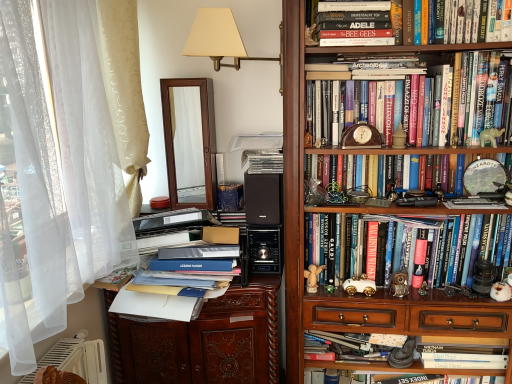
Question: Can you confirm if wooden bookshelf at upper right is bigger than beige fabric lampshade at upper center?

Choices:
 (A) no
 (B) yes

Answer: (B)

Question: Can you confirm if wooden bookshelf at upper right is positioned to the left of beige fabric lampshade at upper center?

Choices:
 (A) no
 (B) yes

Answer: (A)

Question: Can you confirm if wooden bookshelf at upper right is shorter than beige fabric lampshade at upper center?

Choices:
 (A) no
 (B) yes

Answer: (A)

Question: Is wooden bookshelf at upper right in front of beige fabric lampshade at upper center?

Choices:
 (A) no
 (B) yes

Answer: (B)

Question: From a real-world perspective, is wooden bookshelf at upper right positioned over beige fabric lampshade at upper center based on gravity?

Choices:
 (A) no
 (B) yes

Answer: (A)

Question: From a real-world perspective, is black matte speaker at center positioned above or below hardcover book at upper center, which is the fifth book in bottom-to-top order?

Choices:
 (A) above
 (B) below

Answer: (B)

Question: Considering the positions of black matte speaker at center and hardcover book at upper center, which is the fifth book in bottom-to-top order, in the image, is black matte speaker at center wider or thinner than hardcover book at upper center, which is the fifth book in bottom-to-top order,?

Choices:
 (A) thin
 (B) wide

Answer: (A)

Question: From the image's perspective, relative to hardcover book at upper center, the 2th book positioned from the top, is black matte speaker at center above or below?

Choices:
 (A) above
 (B) below

Answer: (B)

Question: Is black matte speaker at center spatially inside hardcover book at upper center, which is the fifth book in bottom-to-top order, or outside of it?

Choices:
 (A) outside
 (B) inside

Answer: (A)

Question: Considering the positions of point (180, 258) and point (406, 291), is point (180, 258) closer or farther from the camera than point (406, 291)?

Choices:
 (A) closer
 (B) farther

Answer: (B)

Question: Considering the positions of blue matte book at center, acting as the second paperback book starting from the top, and metallic owl at center-right, which is the third toy from left to right, in the image, is blue matte book at center, acting as the second paperback book starting from the top, bigger or smaller than metallic owl at center-right, which is the third toy from left to right,?

Choices:
 (A) big
 (B) small

Answer: (A)

Question: In terms of width, does blue matte book at center, which is the 1th paperback book from bottom to top, look wider or thinner when compared to metallic owl at center-right, positioned as the third toy in top-to-bottom order?

Choices:
 (A) thin
 (B) wide

Answer: (B)

Question: Would you say blue matte book at center, which is the 1th paperback book from bottom to top, is to the left or to the right of metallic owl at center-right, positioned as the 2th toy in bottom-to-top order, in the picture?

Choices:
 (A) left
 (B) right

Answer: (A)

Question: Considering the positions of wooden carved file cabinet at center and wooden bookshelf at upper right in the image, is wooden carved file cabinet at center taller or shorter than wooden bookshelf at upper right?

Choices:
 (A) short
 (B) tall

Answer: (A)

Question: Visually, is wooden carved file cabinet at center positioned to the left or to the right of wooden bookshelf at upper right?

Choices:
 (A) right
 (B) left

Answer: (B)